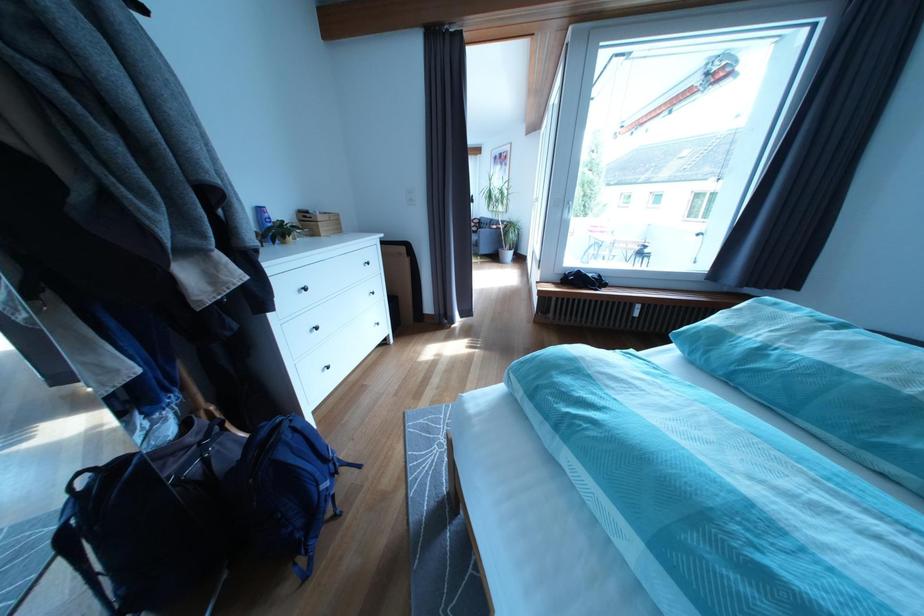
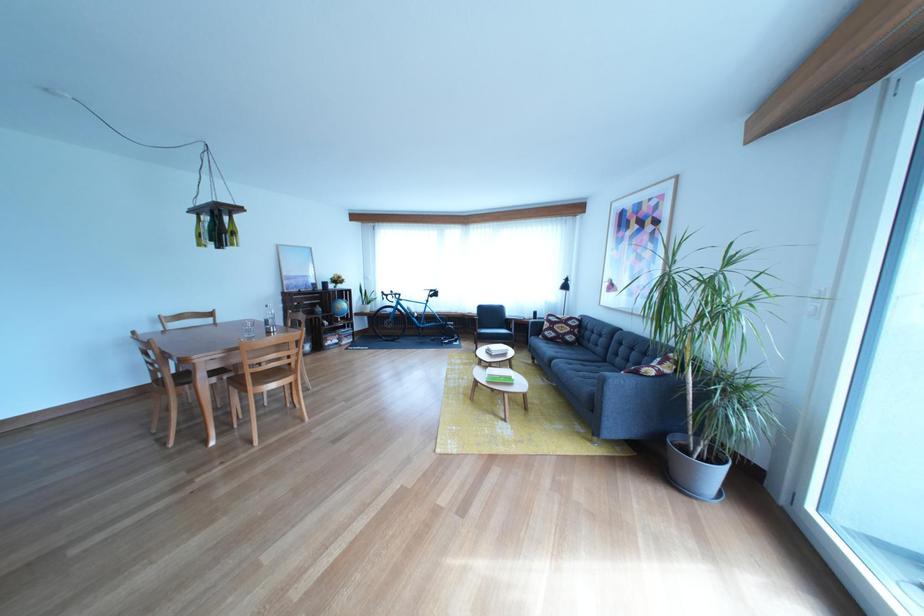
Question: In a continuous first-person perspective shot, in which direction is the camera moving?

Choices:
 (A) Left
 (B) Right
 (C) Forward
 (D) Backward

Answer: (C)